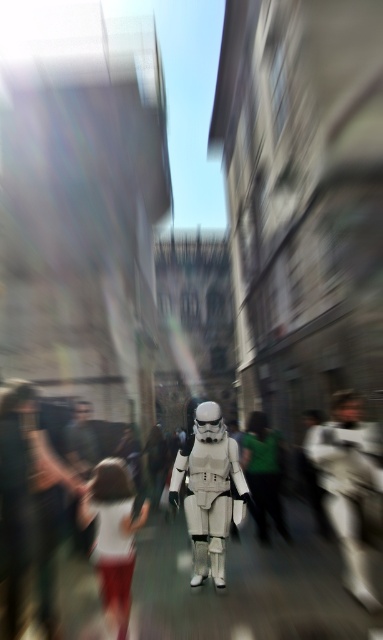
You are a photographer trying to capture a clear shot of both the white matte stormtrooper at center and the white cotton dress at lower left. Considering their sizes, which object should you zoom in on first to ensure it fits entirely within the frame?

The white cotton dress at lower left is shorter than the white matte stormtrooper at center, so you should zoom in on the white cotton dress at lower left first to ensure it fits entirely within the frame.

You are a photographer trying to capture a clear shot of the white matte stormtrooper at center and the white cotton dress at lower left. Since the background is blurred due to motion, which object should you focus on to ensure it appears sharp in the photo?

You should focus on the white matte stormtrooper at center because it is positioned to the right of the white cotton dress at lower left, making it more likely to be in focus given the camera movement direction.

You are a photographer who just took this photo. You want to know if the white matte stormtrooper at center is positioned higher than the white cotton dress at lower left in the image. Can you confirm?

Yes, the white matte stormtrooper at center is positioned higher than the white cotton dress at lower left in the image because it is described as being above it.